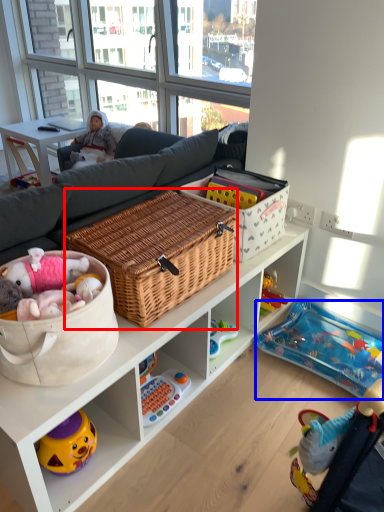
Question: Which point is further to the camera, picnic basket (highlighted by a red box) or infant bed (highlighted by a blue box)?

Choices:
 (A) picnic basket
 (B) infant bed

Answer: (B)